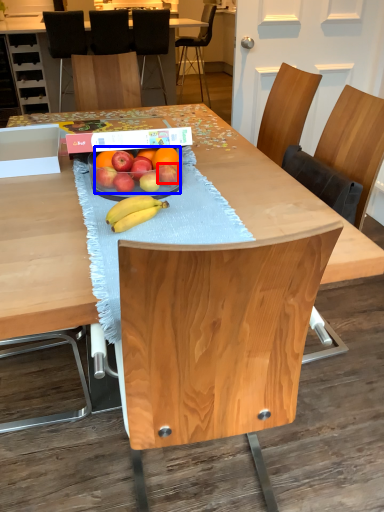
Question: Which object appears farthest to the camera in this image, apple (highlighted by a red box) or grapefruit (highlighted by a blue box)?

Choices:
 (A) apple
 (B) grapefruit

Answer: (A)